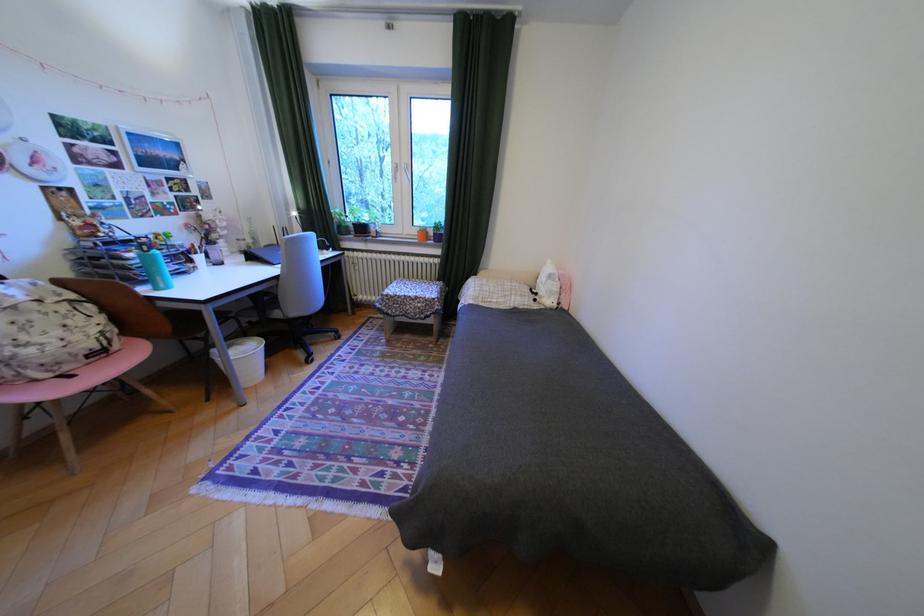
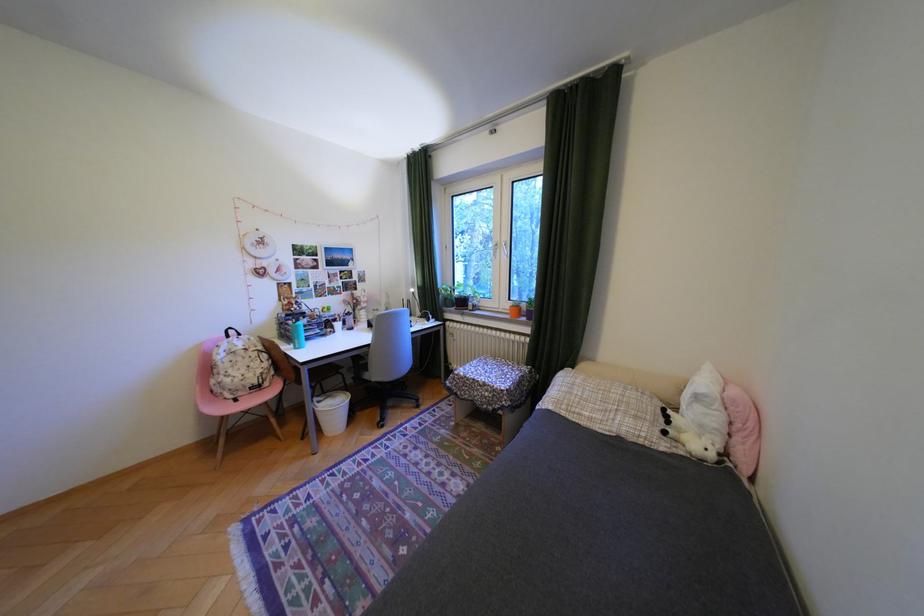
Where in the second image is the point corresponding to (137,267) from the first image?

(300, 331)